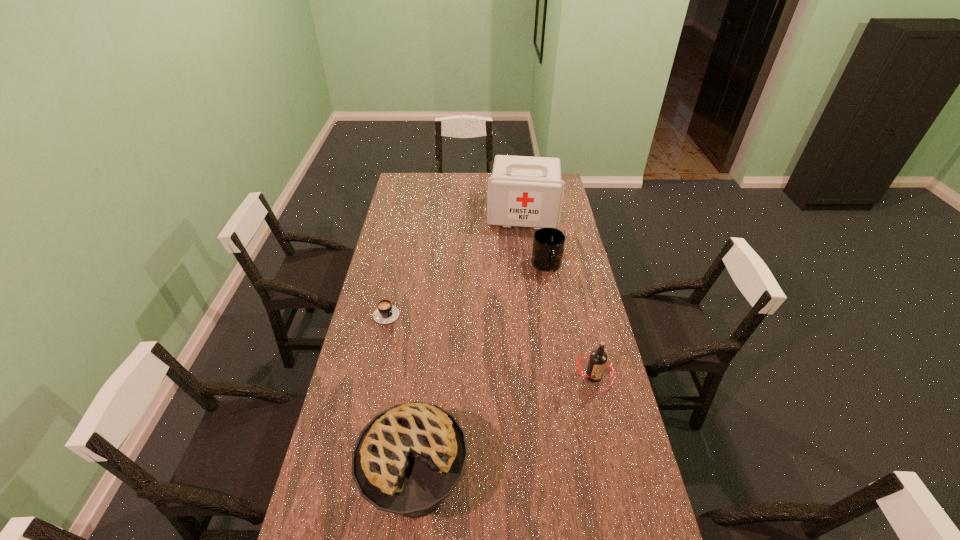
What are the coordinates of `root beer` in the screenshot? It's located at (598, 360).

Where is `the second nearest object`? the second nearest object is located at coordinates (598, 360).

Locate an element on the screen. The width and height of the screenshot is (960, 540). the fourth tallest object is located at coordinates (548, 244).

Identify the location of the second farthest object. The image size is (960, 540). (548, 244).

Find the location of `the farthest object`. the farthest object is located at coordinates (523, 191).

Where is `the tallest object`? The width and height of the screenshot is (960, 540). the tallest object is located at coordinates (523, 191).

Identify the location of the shortest object. The width and height of the screenshot is (960, 540). (385, 313).

Find the location of a particular element. The width and height of the screenshot is (960, 540). cappuccino is located at coordinates (385, 313).

The width and height of the screenshot is (960, 540). Identify the location of vacant space located on the label of the root beer. [607, 433].

This screenshot has height=540, width=960. I want to click on free space located with the handle on the side of the mug, so click(x=544, y=295).